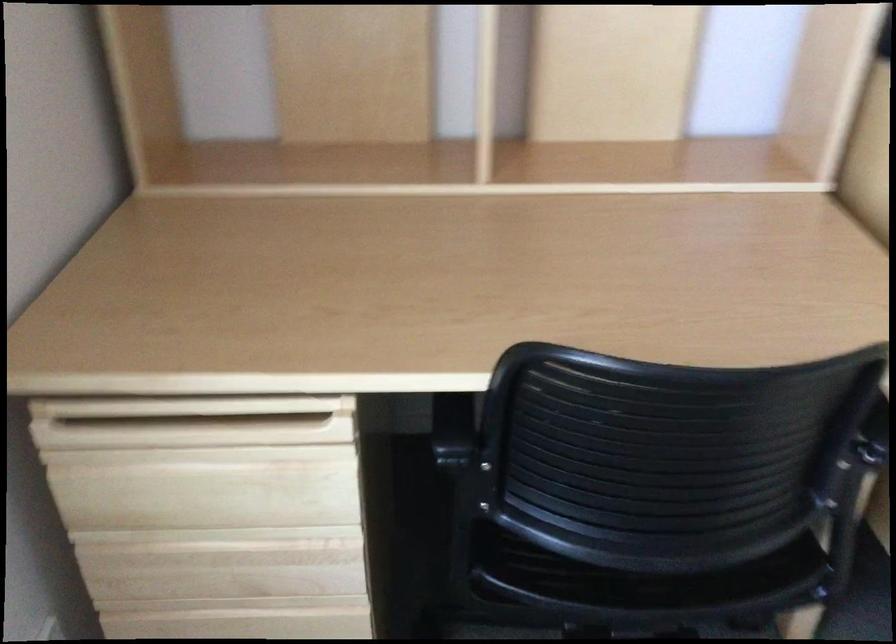
This screenshot has width=896, height=644. What do you see at coordinates (192, 422) in the screenshot? I see `the drawer pull handle` at bounding box center [192, 422].